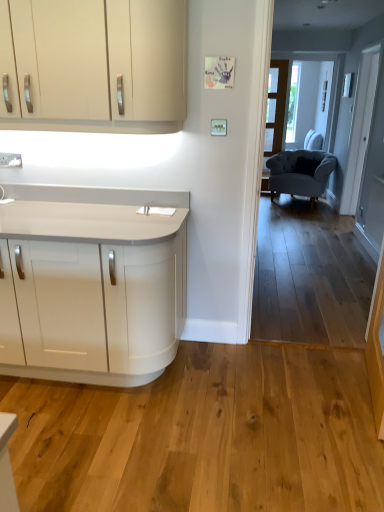
At what (x,y) coordinates should I click in order to perform the action: click on free location to the right of white glossy countertop at lower left. Please return your answer as a coordinate pair (x, y). The width and height of the screenshot is (384, 512). Looking at the image, I should click on (235, 399).